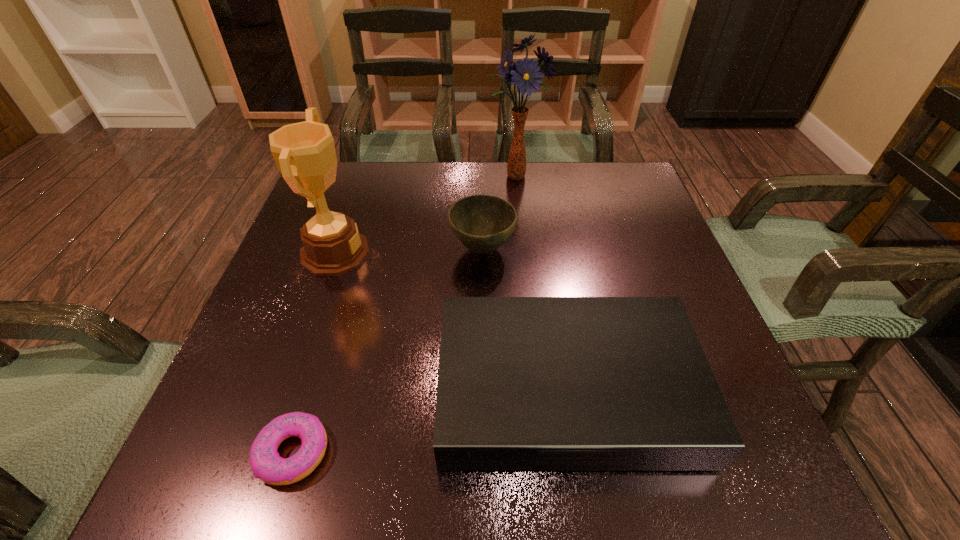
Locate an element on the screen. The width and height of the screenshot is (960, 540). free space that satisfies the following two spatial constraints: 1. on the front-facing side of the fourth shortest object; 2. on the back side of the doughnut is located at coordinates point(266,452).